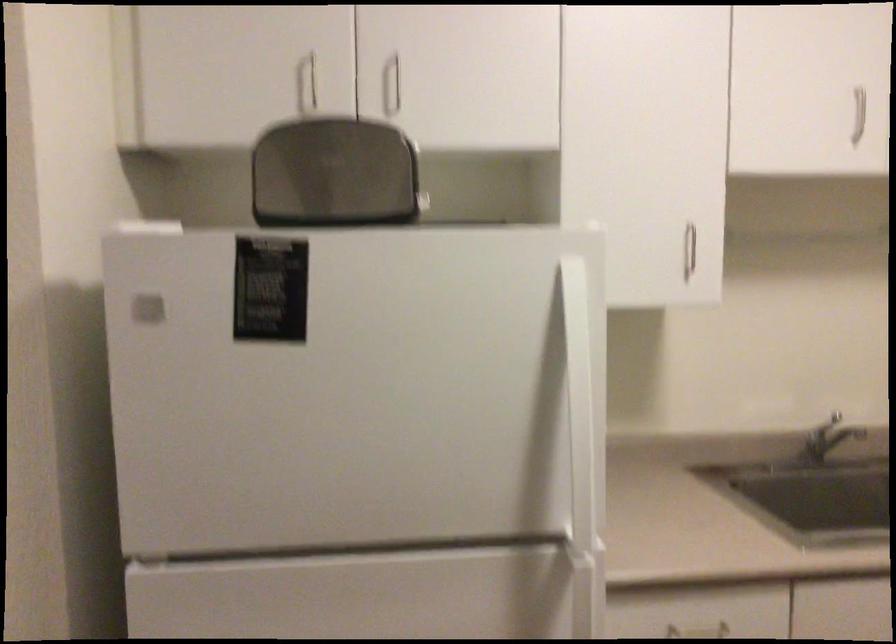
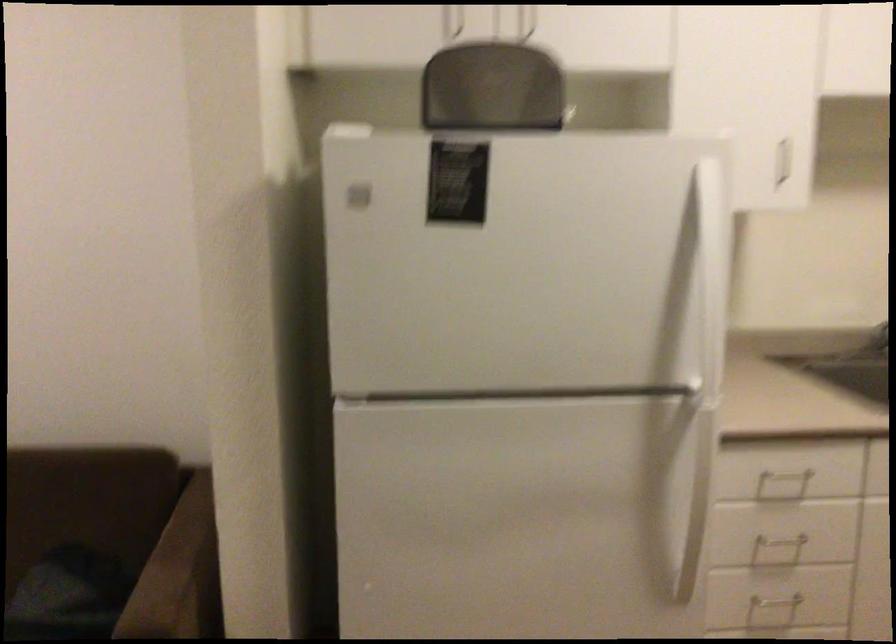
Consider the image. Which direction would the cameraman need to move to produce the second image?

The cameraman walked toward left, backward.